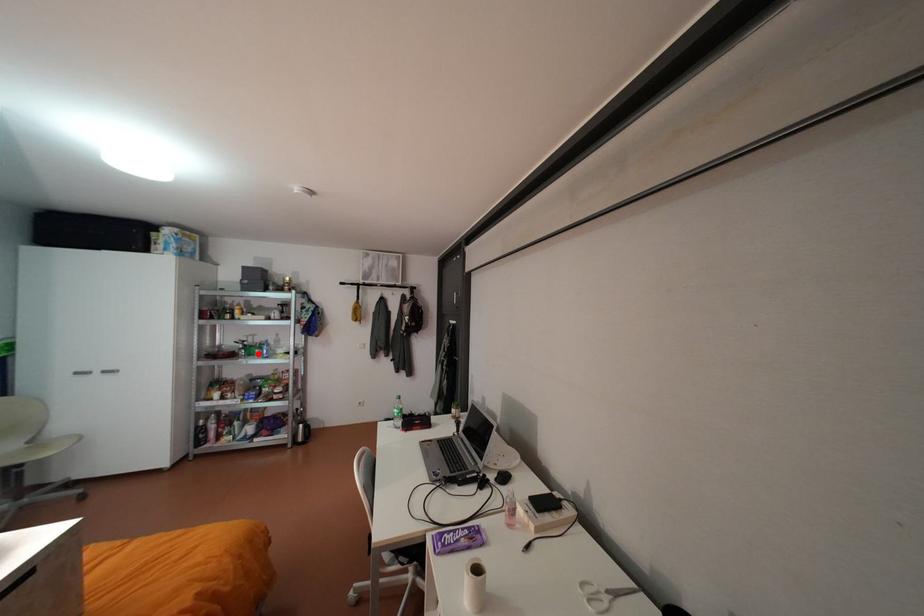
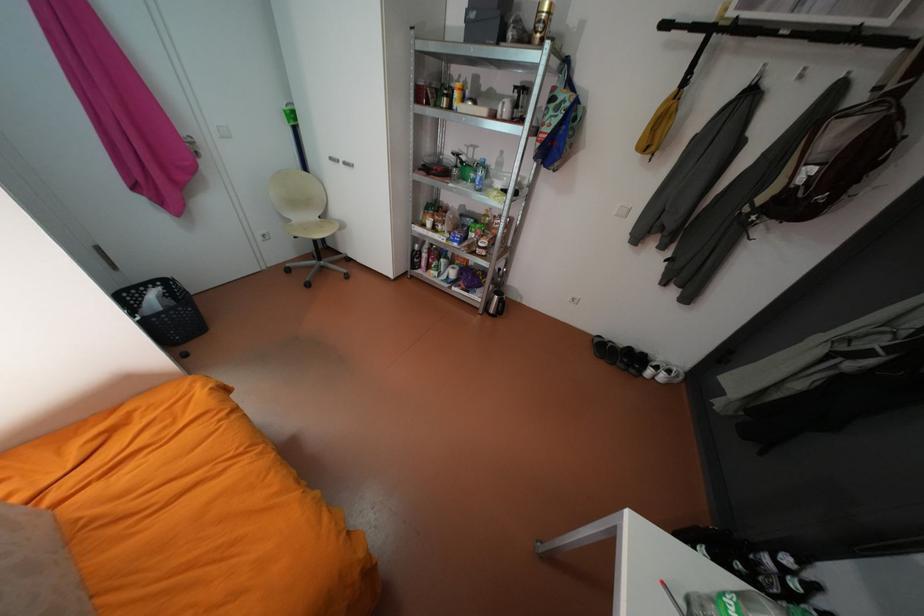
Question: I am providing you with two images of the same scene from different viewpoints. A red point is shown in image1. For the corresponding object point in image2, is it positioned nearer or farther from the camera?

Choices:
 (A) Nearer
 (B) Farther

Answer: (A)